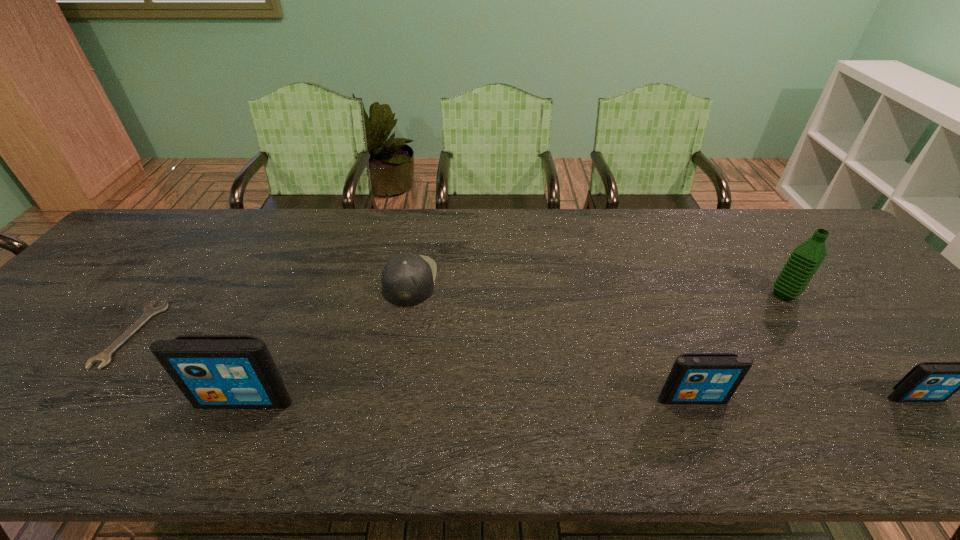
The height and width of the screenshot is (540, 960). I want to click on the fifth object from right to left, so click(x=212, y=371).

The width and height of the screenshot is (960, 540). I want to click on the tallest iPod, so click(x=212, y=371).

Where is `the third tallest object`? the third tallest object is located at coordinates (695, 378).

Find the location of a particular element. the second iPod from left to right is located at coordinates (695, 378).

Identify the location of the shortest iPod. (929, 381).

Locate an element on the screen. the rightmost iPod is located at coordinates (929, 381).

Where is `the shortest object`? This screenshot has width=960, height=540. the shortest object is located at coordinates (104, 357).

Locate an element on the screen. the leftmost object is located at coordinates (104, 357).

This screenshot has width=960, height=540. I want to click on cap, so click(407, 279).

Where is `the fourth object from right to left`? This screenshot has height=540, width=960. the fourth object from right to left is located at coordinates (407, 279).